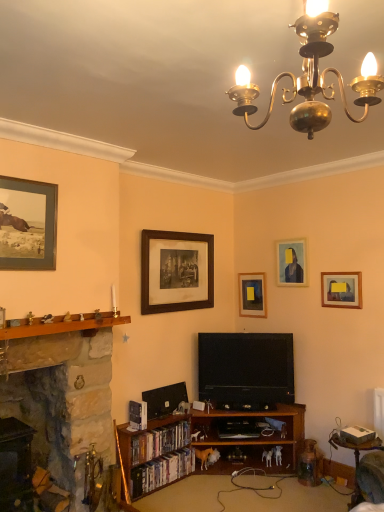
Question: Is wooden at left taller than matte wooden picture frame at upper right, which is counted as the 2th picture frame, starting from the right?

Choices:
 (A) yes
 (B) no

Answer: (B)

Question: Does wooden at left turn towards matte wooden picture frame at upper right, which is counted as the fourth picture frame, starting from the front?

Choices:
 (A) no
 (B) yes

Answer: (A)

Question: From a real-world perspective, is wooden at left positioned under matte wooden picture frame at upper right, which is counted as the 2th picture frame, starting from the right, based on gravity?

Choices:
 (A) yes
 (B) no

Answer: (A)

Question: From a real-world perspective, is wooden at left over matte wooden picture frame at upper right, arranged as the 2th picture frame when viewed from the back?

Choices:
 (A) yes
 (B) no

Answer: (B)

Question: Is wooden at left thinner than matte wooden picture frame at upper right, which is counted as the 2th picture frame, starting from the right?

Choices:
 (A) yes
 (B) no

Answer: (B)

Question: Relative to wooden picture frame at center, placed as the third picture frame when sorted from left to right, is wooden round table at lower right in front or behind?

Choices:
 (A) front
 (B) behind

Answer: (A)

Question: From their relative heights in the image, would you say wooden round table at lower right is taller or shorter than wooden picture frame at center, the 1th picture frame when ordered from back to front?

Choices:
 (A) tall
 (B) short

Answer: (A)

Question: Is point (362, 442) positioned closer to the camera than point (256, 311)?

Choices:
 (A) farther
 (B) closer

Answer: (B)

Question: From the image's perspective, is wooden round table at lower right located above or below wooden picture frame at center, the 1th picture frame when ordered from back to front?

Choices:
 (A) below
 (B) above

Answer: (A)

Question: From a real-world perspective, is stone fireplace at left above or below matte wooden picture frame at upper left, the 5th picture frame viewed from the back?

Choices:
 (A) above
 (B) below

Answer: (B)

Question: From the image's perspective, is stone fireplace at left above or below matte wooden picture frame at upper left, the 5th picture frame viewed from the back?

Choices:
 (A) below
 (B) above

Answer: (A)

Question: In terms of size, does stone fireplace at left appear bigger or smaller than matte wooden picture frame at upper left, which ranks as the 1th picture frame in left-to-right order?

Choices:
 (A) big
 (B) small

Answer: (A)

Question: In terms of height, does stone fireplace at left look taller or shorter compared to matte wooden picture frame at upper left, the first picture frame from the front?

Choices:
 (A) short
 (B) tall

Answer: (B)

Question: From a real-world perspective, is wooden bookshelf at lower center above or below matte wooden picture frame at upper left, which ranks as the 1th picture frame in left-to-right order?

Choices:
 (A) below
 (B) above

Answer: (A)

Question: Based on their sizes in the image, would you say wooden bookshelf at lower center is bigger or smaller than matte wooden picture frame at upper left, the 5th picture frame viewed from the back?

Choices:
 (A) small
 (B) big

Answer: (B)